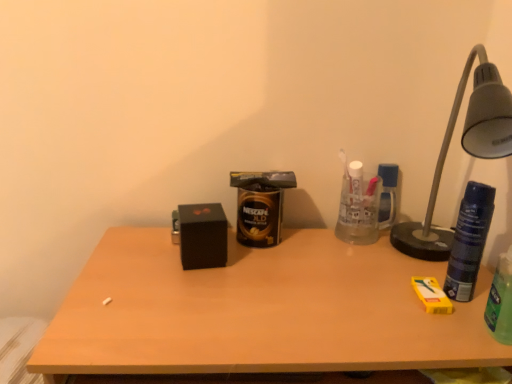
Question: Does point (279, 238) appear closer or farther from the camera than point (210, 215)?

Choices:
 (A) farther
 (B) closer

Answer: (A)

Question: Is gold metallic can at center, the 1th beverage in the left-to-right sequence, bigger or smaller than black matte box at center?

Choices:
 (A) small
 (B) big

Answer: (B)

Question: Which object is positioned closest to the blue textured can at right, which appears as the second beverage when viewed from the back?

Choices:
 (A) black matte box at center
 (B) metallic gray lamp at right
 (C) green plastic bottle at right, which appears as the 1th beverage when viewed from the right
 (D) wooden desk at center
 (E) gold metallic can at center, the 1th beverage positioned from the back

Answer: (C)

Question: Which is farther from the green plastic bottle at right, the first beverage in the front-to-back sequence?

Choices:
 (A) gold metallic can at center, the 1th beverage in the left-to-right sequence
 (B) metallic gray lamp at right
 (C) blue textured can at right, the 2th beverage in the right-to-left sequence
 (D) wooden desk at center
 (E) black matte box at center

Answer: (E)